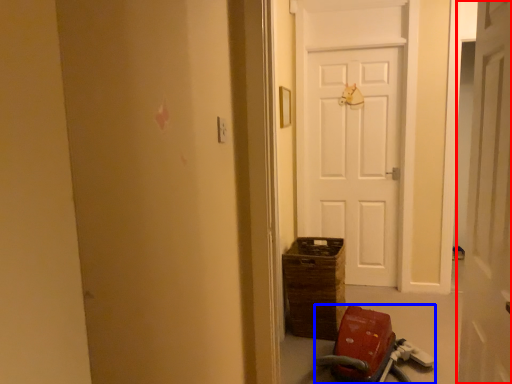
Question: Which object is further to the camera taking this photo, door (highlighted by a red box) or baby carriage (highlighted by a blue box)?

Choices:
 (A) door
 (B) baby carriage

Answer: (B)